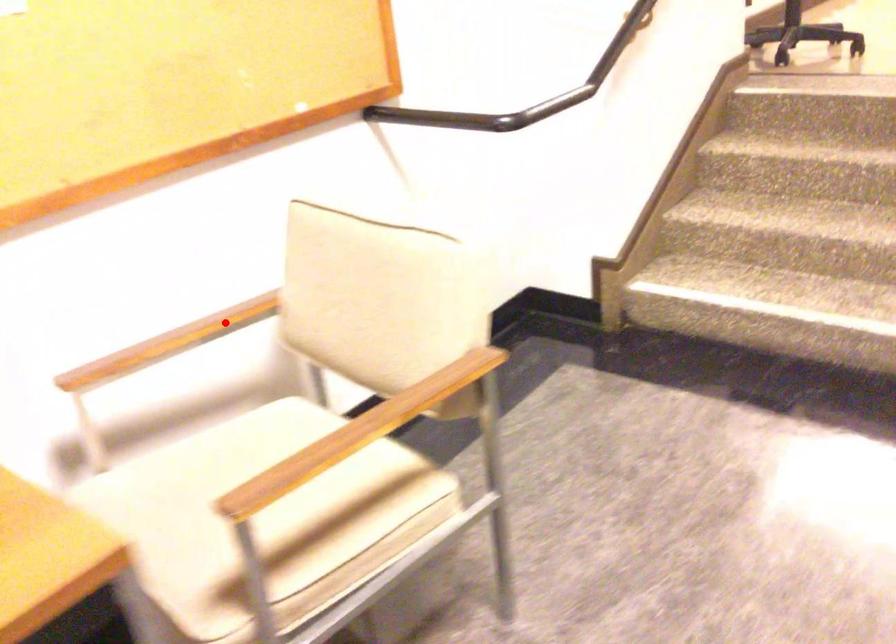
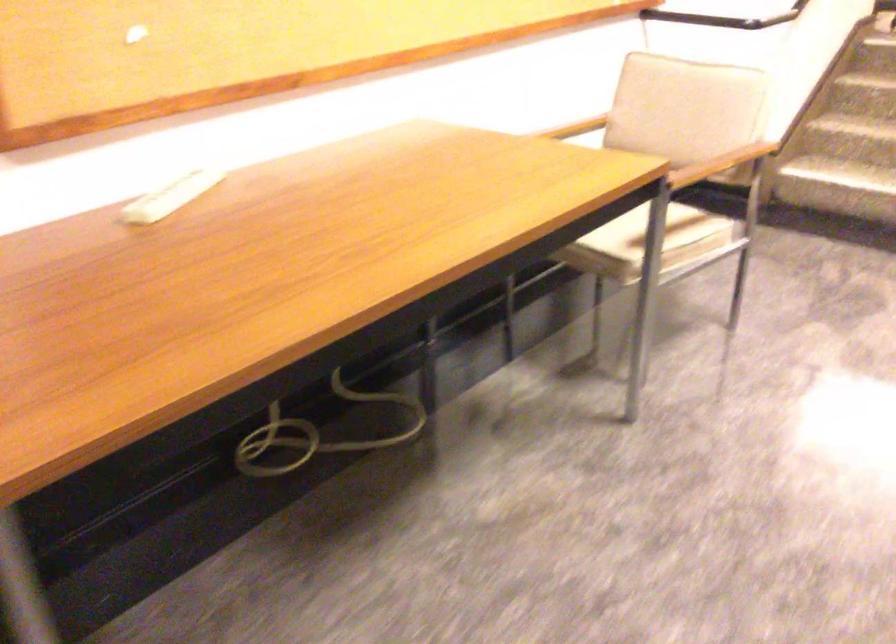
The point at the highlighted location is marked in the first image. Where is the corresponding point in the second image?

(574, 128)